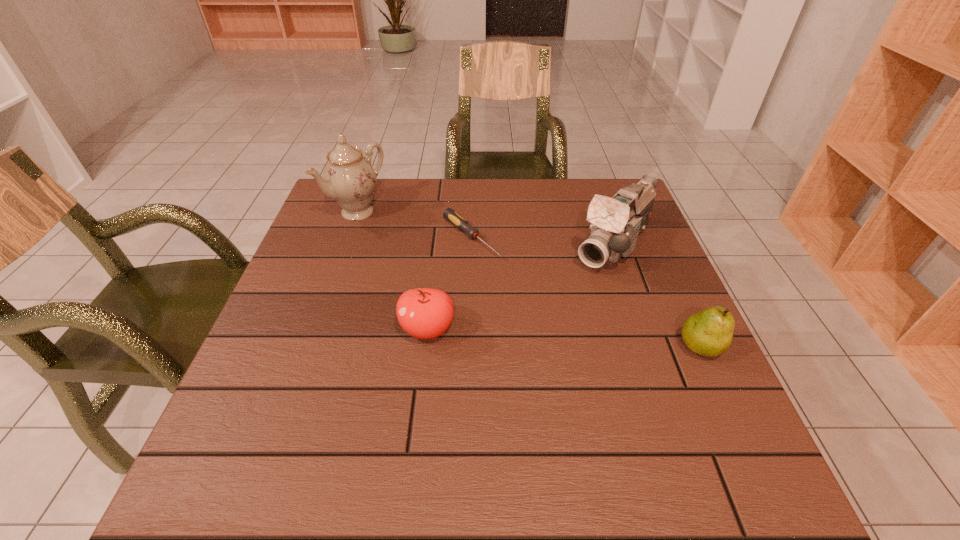
Locate which object ranks second in proximity to the shortest object. Please provide its 2D coordinates. Your answer should be formatted as a tuple, i.e. [(x, y)], where the tuple contains the x and y coordinates of a point satisfying the conditions above.

[(425, 313)]

This screenshot has height=540, width=960. I want to click on vacant space that satisfies the following two spatial constraints: 1. on the front side of the chinaware; 2. on the left side of the apple, so click(x=317, y=329).